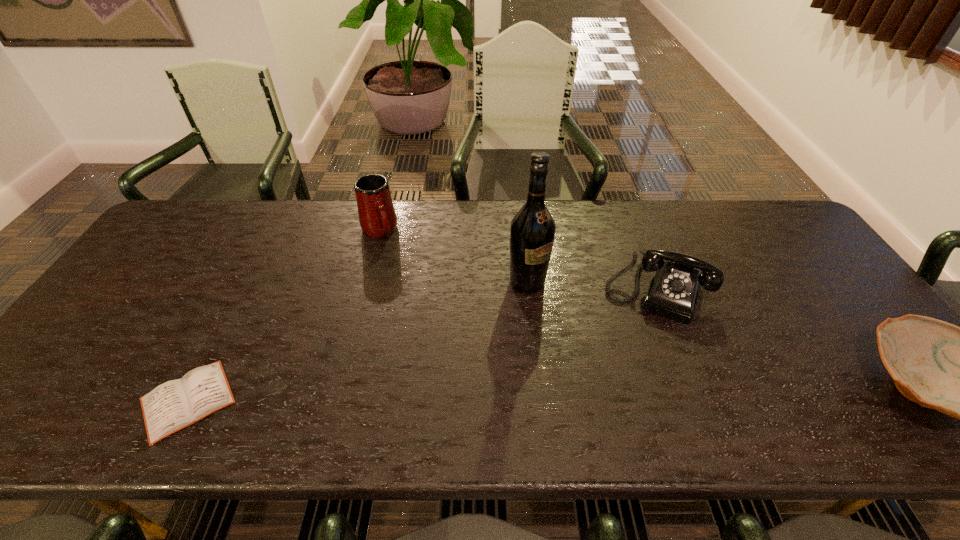
Find the location of a particular element. free space at the far edge is located at coordinates (406, 242).

Find the location of a particular element. This screenshot has height=540, width=960. vacant area at the near edge is located at coordinates (727, 376).

Where is `vacant area at the left edge`? Image resolution: width=960 pixels, height=540 pixels. vacant area at the left edge is located at coordinates (135, 285).

The height and width of the screenshot is (540, 960). In the image, there is a desktop. Find the location of `free space at the right edge`. free space at the right edge is located at coordinates (784, 275).

You are a GUI agent. You are given a task and a screenshot of the screen. Output one action in this format:
    pyautogui.click(x=<x>, y=<y>)
    Task: Click on the blank space at the far left corner of the desktop
    
    Given the screenshot: What is the action you would take?
    pyautogui.click(x=204, y=220)

The image size is (960, 540). What are the coordinates of `free space between the farthest object and the third object from left to right` in the screenshot? It's located at (453, 256).

You are a GUI agent. You are given a task and a screenshot of the screen. Output one action in this format:
    pyautogui.click(x=<x>, y=<y>)
    Task: Click on the free space between the wine bottle and the fourth object from left to right
    Image resolution: width=960 pixels, height=540 pixels.
    Given the screenshot: What is the action you would take?
    (x=591, y=286)

What are the coordinates of `free area in between the diary and the second object from left to right` in the screenshot? It's located at (283, 316).

In order to click on object that is the third closest to the diary in this screenshot , I will do `click(673, 290)`.

Select which object appears as the second closest to the wine bottle. Please provide its 2D coordinates. Your answer should be formatted as a tuple, i.e. [(x, y)], where the tuple contains the x and y coordinates of a point satisfying the conditions above.

[(377, 217)]